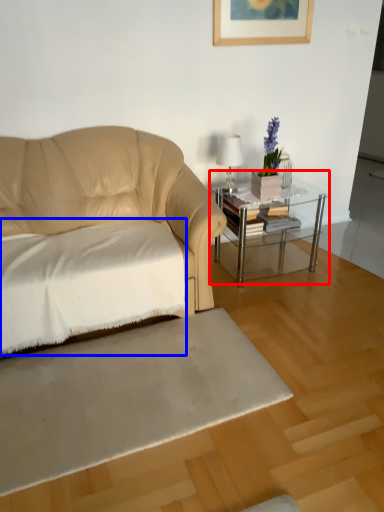
Question: Which object is further to the camera taking this photo, table (highlighted by a red box) or sheet (highlighted by a blue box)?

Choices:
 (A) table
 (B) sheet

Answer: (A)